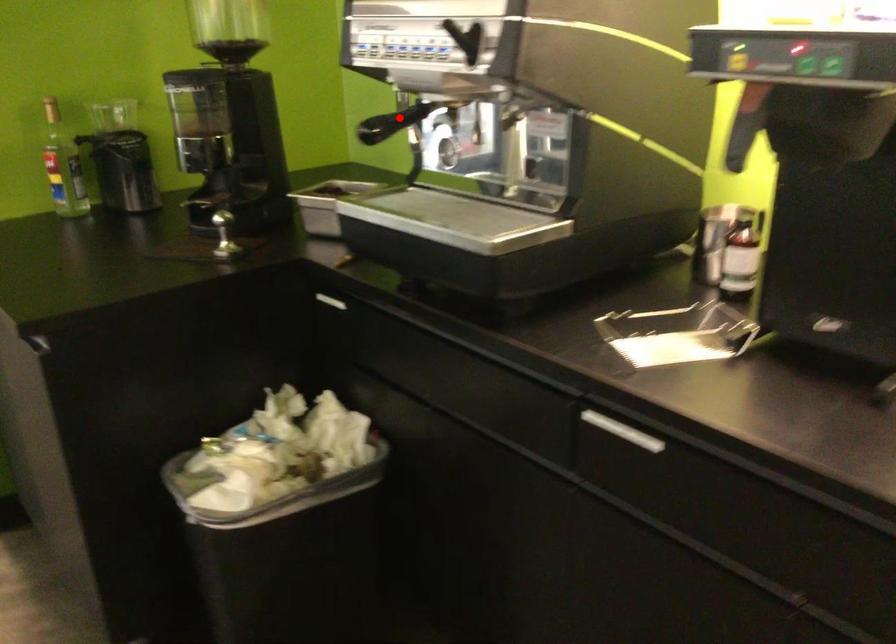
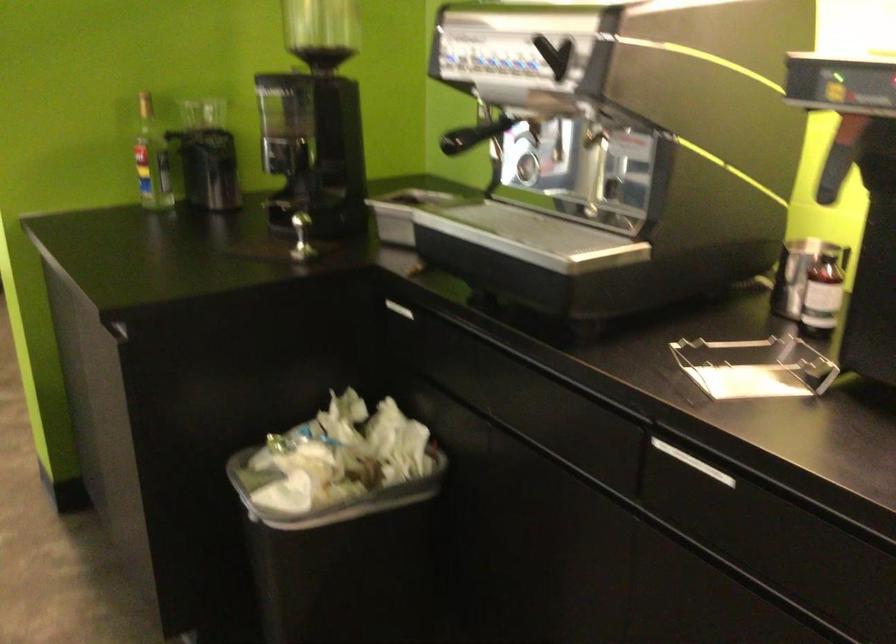
In the second image, find the point that corresponds to the highlighted location in the first image.

(484, 131)